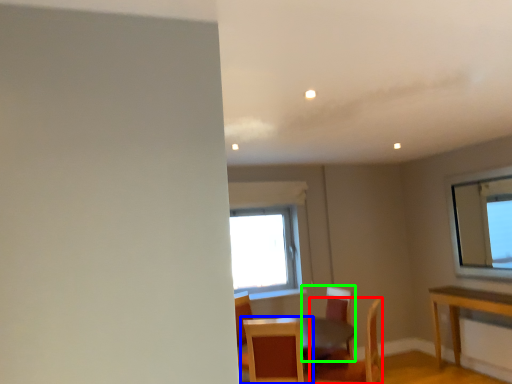
Question: Considering the real-world distances, which object is closest to chair (highlighted by a red box)? chair (highlighted by a blue box) or chair (highlighted by a green box).

Choices:
 (A) chair
 (B) chair

Answer: (B)